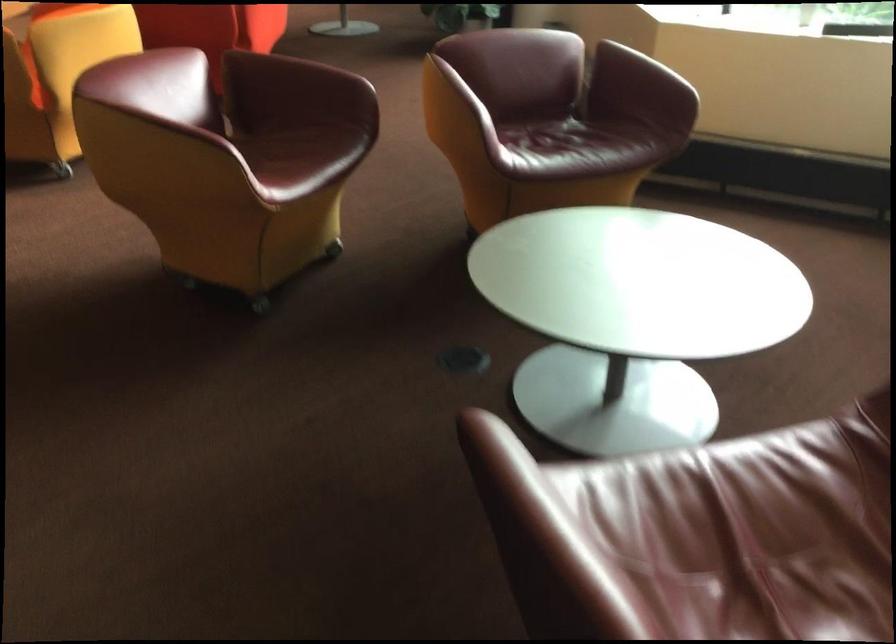
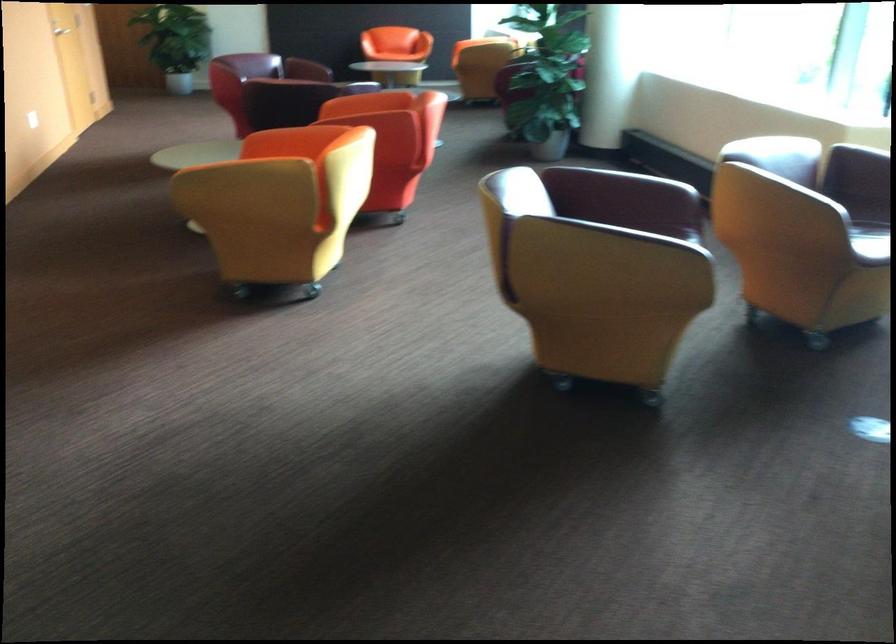
Question: I am providing you with two images of the same scene from different viewpoints. Please identify which objects are invisible in image2.

Choices:
 (A) red chair armrest
 (B) yellow chair armrest
 (C) red wicker box
 (D) orange chair sitting surface

Answer: (A)